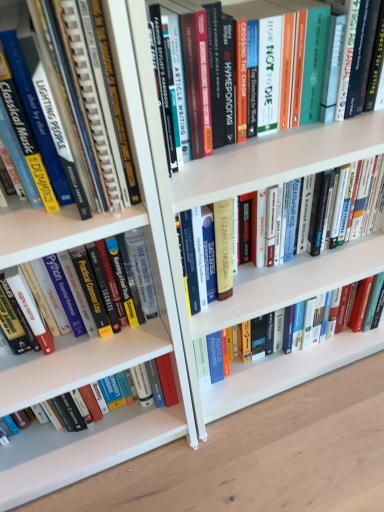
Question: Does hardcover book at center, acting as the 1th book starting from the top, have a lesser height compared to hardcover book at center, the 2th book positioned from the bottom?

Choices:
 (A) yes
 (B) no

Answer: (B)

Question: Is hardcover book at center, the fifth book when ordered from bottom to top, closer to camera compared to hardcover book at center, the 2th book positioned from the bottom?

Choices:
 (A) no
 (B) yes

Answer: (B)

Question: From a real-world perspective, is hardcover book at center, the fifth book when ordered from bottom to top, beneath hardcover book at center, which ranks as the fourth book in top-to-bottom order?

Choices:
 (A) yes
 (B) no

Answer: (B)

Question: From the image's perspective, would you say hardcover book at center, the fifth book when ordered from bottom to top, is shown under hardcover book at center, which ranks as the fourth book in top-to-bottom order?

Choices:
 (A) yes
 (B) no

Answer: (B)

Question: Is hardcover book at center, acting as the 1th book starting from the top, taller than hardcover book at center, which ranks as the fourth book in top-to-bottom order?

Choices:
 (A) yes
 (B) no

Answer: (A)

Question: Can you confirm if hardcover book at center, acting as the 1th book starting from the top, is positioned to the right of hardcover book at center, which ranks as the fourth book in top-to-bottom order?

Choices:
 (A) yes
 (B) no

Answer: (B)

Question: Is hardcover book at left, which ranks as the 3th book in top-to-bottom order, taller than hardcover book at center, which ranks as the fourth book in top-to-bottom order?

Choices:
 (A) no
 (B) yes

Answer: (B)

Question: From the image's perspective, is hardcover book at left, the 3th book ordered from the bottom, on hardcover book at center, the 2th book positioned from the bottom?

Choices:
 (A) yes
 (B) no

Answer: (A)

Question: Does hardcover book at left, which ranks as the 3th book in top-to-bottom order, come in front of hardcover book at center, the 2th book positioned from the bottom?

Choices:
 (A) yes
 (B) no

Answer: (A)

Question: From a real-world perspective, is hardcover book at left, which ranks as the 3th book in top-to-bottom order, on top of hardcover book at center, the 2th book positioned from the bottom?

Choices:
 (A) yes
 (B) no

Answer: (A)

Question: From a real-world perspective, is hardcover book at left, which ranks as the 3th book in top-to-bottom order, positioned under hardcover book at center, the 2th book positioned from the bottom, based on gravity?

Choices:
 (A) no
 (B) yes

Answer: (A)

Question: Considering the relative sizes of hardcover book at left, which ranks as the 3th book in top-to-bottom order, and hardcover book at center, which ranks as the fourth book in top-to-bottom order, in the image provided, is hardcover book at left, which ranks as the 3th book in top-to-bottom order, shorter than hardcover book at center, which ranks as the fourth book in top-to-bottom order,?

Choices:
 (A) no
 (B) yes

Answer: (A)

Question: Considering the relative positions of hardcover book at center, positioned as the second book in top-to-bottom order, and hardcover book at lower left, the 1th book from the bottom, in the image provided, is hardcover book at center, positioned as the second book in top-to-bottom order, to the left of hardcover book at lower left, the 1th book from the bottom, from the viewer's perspective?

Choices:
 (A) yes
 (B) no

Answer: (B)